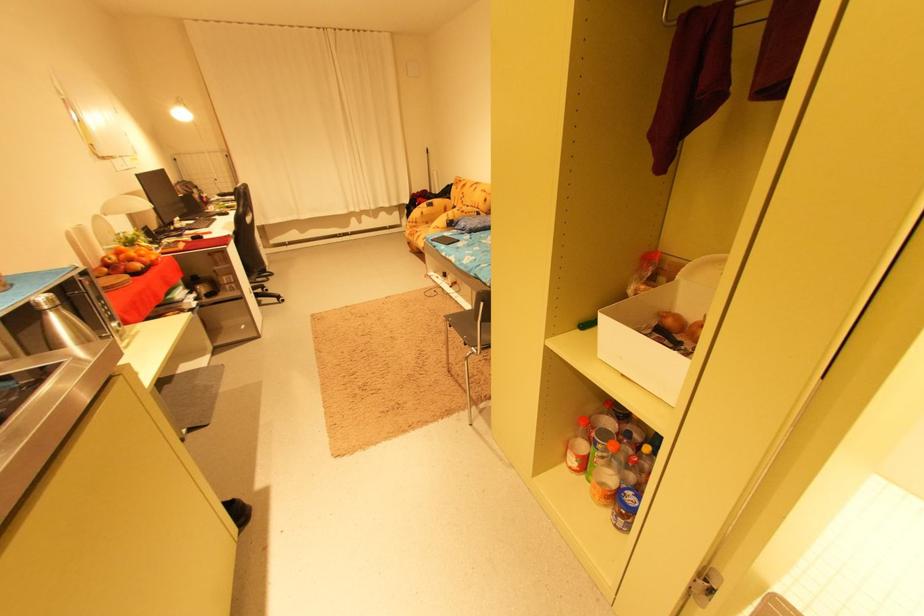
Find the location of a particular element. Image resolution: width=924 pixels, height=616 pixels. chair armrest is located at coordinates tap(381, 248).